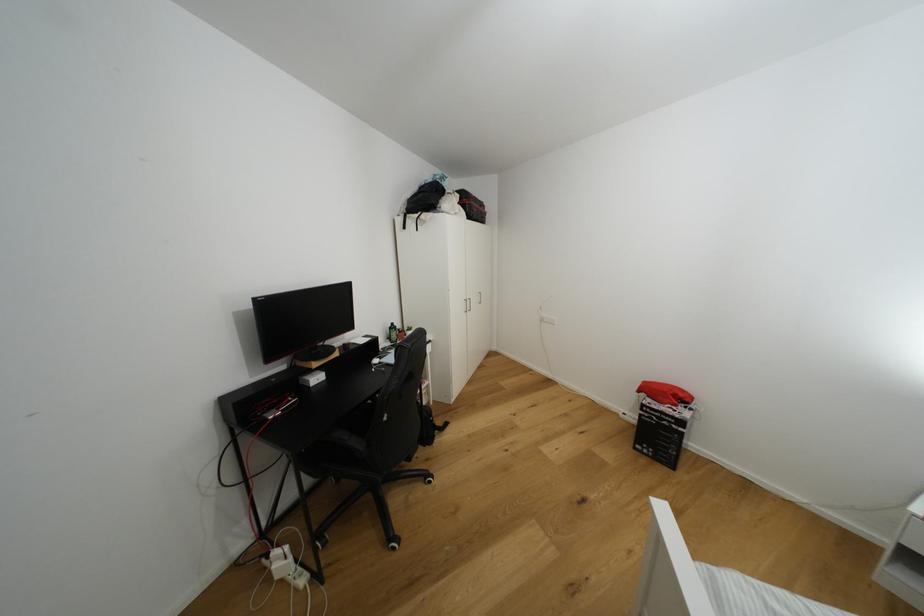
Describe the element at coordinates (392, 333) in the screenshot. The image size is (924, 616). I see `a green bottle` at that location.